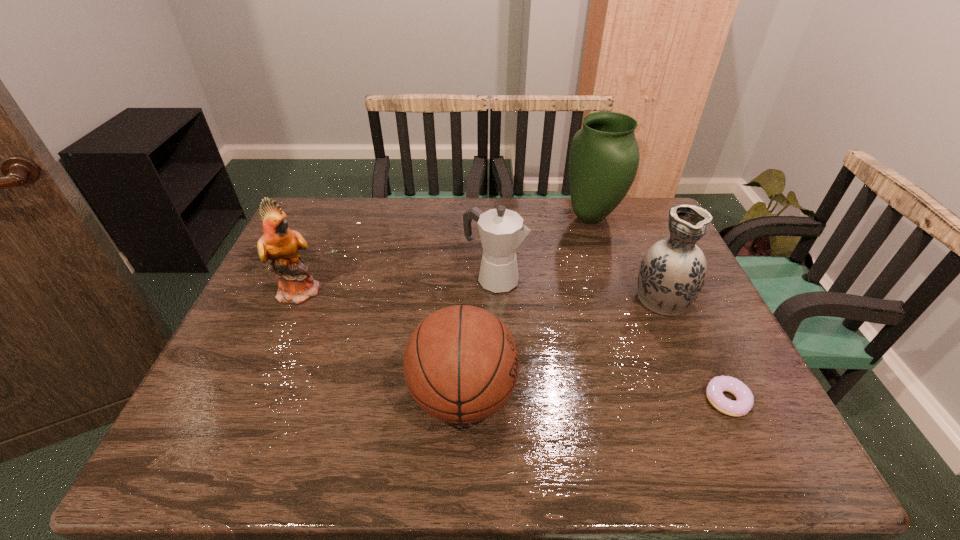
Locate an element on the screen. vacant area at the far edge is located at coordinates (425, 233).

You are a GUI agent. You are given a task and a screenshot of the screen. Output one action in this format:
    pyautogui.click(x=<x>, y=<y>)
    Task: Click on the vacant region at the near edge
    The image size is (960, 540).
    Given the screenshot: What is the action you would take?
    pyautogui.click(x=314, y=447)

The height and width of the screenshot is (540, 960). In the image, there is a desktop. Find the location of `blank space at the right edge`. blank space at the right edge is located at coordinates (708, 306).

Where is `blank space at the far right corner of the desktop`? The width and height of the screenshot is (960, 540). blank space at the far right corner of the desktop is located at coordinates (659, 234).

I want to click on vacant region between the shortest object and the shorter vase, so click(694, 349).

Where is `empty location between the basketball and the doughnut`? empty location between the basketball and the doughnut is located at coordinates (595, 398).

Image resolution: width=960 pixels, height=540 pixels. Find the location of `unoccupied area between the farthest object and the parrot`. unoccupied area between the farthest object and the parrot is located at coordinates click(446, 254).

I want to click on free space between the shorter vase and the farther vase, so click(x=626, y=257).

Image resolution: width=960 pixels, height=540 pixels. In order to click on unoccupied position between the basketball and the farthest object in this screenshot , I will do `click(527, 306)`.

In order to click on vacant area between the coffeepot and the farthest object in this screenshot , I will do `click(543, 248)`.